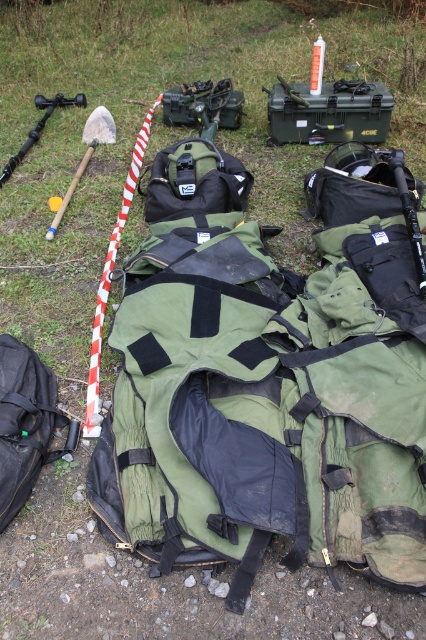
You are a park ranger preparing for a wildfire emergency. You need to quickly grab the taller item between the wooden shovel at left and the matte black rifle at left to clear debris. Which item should you choose?

The wooden shovel at left is taller than the matte black rifle at left, so you should choose the wooden shovel at left to clear debris.

Based on the photo, you are standing at the camera position and looking at the two points marked in the image. Which point, point (72, 188) or point (54, 106), is closer to you?

Point (72, 188) is closer to the camera than point (54, 106).